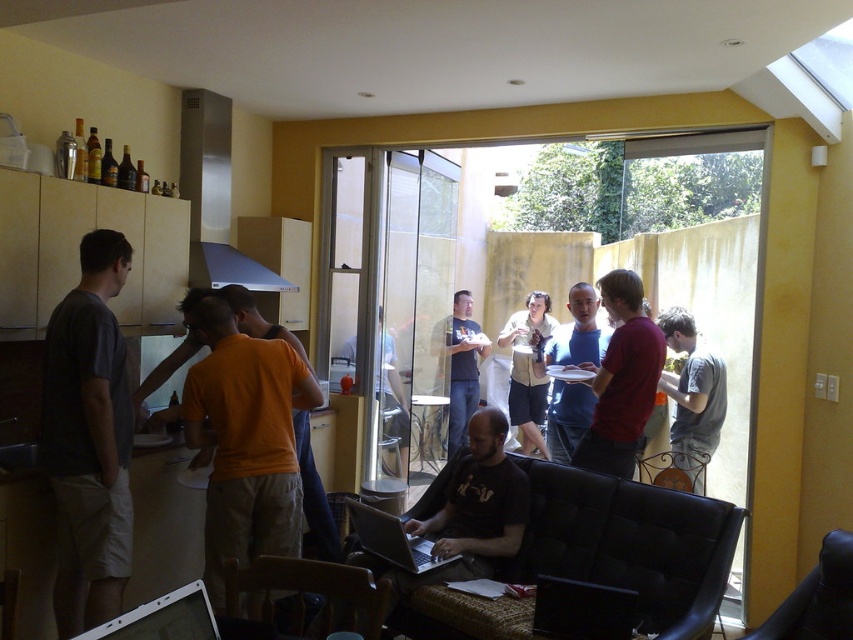
Question: Does orange cotton shirt at center have a smaller size compared to silver metallic laptop at center?

Choices:
 (A) no
 (B) yes

Answer: (A)

Question: Which object is positioned closest to the matte red shirt at center?

Choices:
 (A) matte gray t-shirt at left
 (B) black matte laptop at center
 (C) matte orange shirt at center
 (D) orange t-shirt at center

Answer: (B)

Question: Among these points, which one is nearest to the camera?

Choices:
 (A) (639, 426)
 (B) (525, 429)
 (C) (722, 388)
 (D) (592, 342)

Answer: (A)

Question: From the image, what is the correct spatial relationship of matte red shirt at center in relation to gray cotton shirt at center?

Choices:
 (A) right
 (B) left

Answer: (B)

Question: Considering the relative positions of matte red shirt at center and matte orange shirt at center in the image provided, where is matte red shirt at center located with respect to matte orange shirt at center?

Choices:
 (A) right
 (B) left

Answer: (B)

Question: Among these objects, which one is farthest from the camera?

Choices:
 (A) matte black shirt at center
 (B) matte red shirt at center
 (C) silver metallic laptop at center
 (D) matte gray t-shirt at left

Answer: (A)